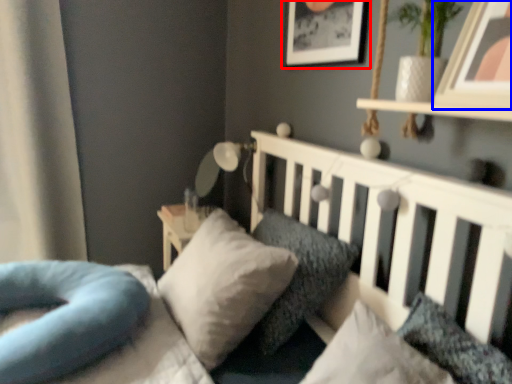
Question: Which object is closer to the camera taking this photo, picture frame (highlighted by a red box) or picture frame (highlighted by a blue box)?

Choices:
 (A) picture frame
 (B) picture frame

Answer: (B)